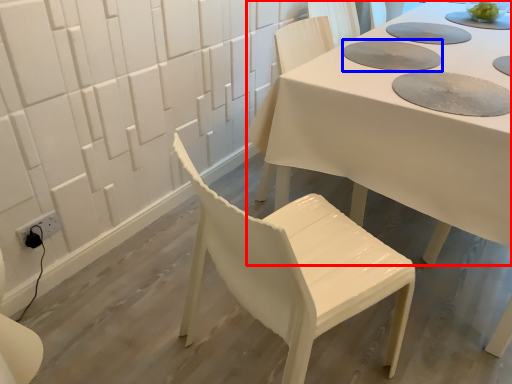
Question: Which object is closer to the camera taking this photo, table (highlighted by a red box) or paper plate (highlighted by a blue box)?

Choices:
 (A) table
 (B) paper plate

Answer: (A)